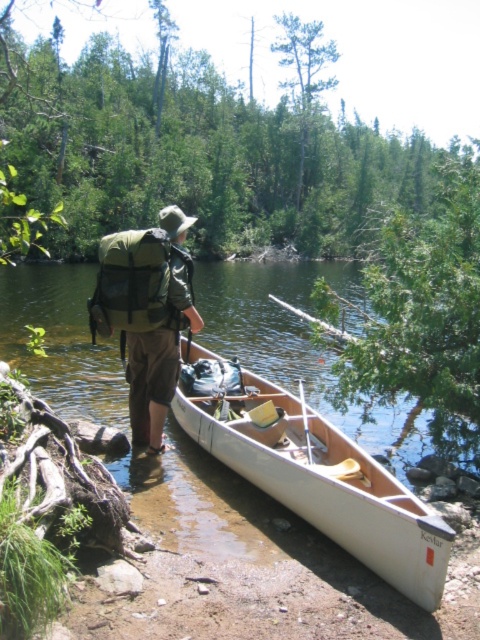
Can you confirm if green fabric backpack at center is positioned below white plastic paddle at center?

Incorrect, green fabric backpack at center is not positioned below white plastic paddle at center.

Is green fabric backpack at center to the left of white plastic paddle at center from the viewer's perspective?

Correct, you'll find green fabric backpack at center to the left of white plastic paddle at center.

Identify the location of green fabric backpack at center. The height and width of the screenshot is (640, 480). (146, 314).

Where is `green fabric backpack at center`? green fabric backpack at center is located at coordinates (146, 314).

The width and height of the screenshot is (480, 640). Describe the element at coordinates (301, 349) in the screenshot. I see `clear water at center` at that location.

Consider the image. Is clear water at center bigger than white plastic paddle at center?

Yes, clear water at center is bigger than white plastic paddle at center.

Between point (286, 364) and point (300, 397), which one is positioned behind?

Positioned behind is point (286, 364).

Where is `clear water at center`? This screenshot has width=480, height=640. clear water at center is located at coordinates (301, 349).

Looking at this image, does clear water at center appear on the left side of green fabric backpack at center?

No, clear water at center is not to the left of green fabric backpack at center.

Can you confirm if clear water at center is thinner than green fabric backpack at center?

No, clear water at center is not thinner than green fabric backpack at center.

Find the location of `clear water at center`. clear water at center is located at coordinates (301, 349).

The image size is (480, 640). What are the coordinates of `clear water at center` in the screenshot? It's located at pyautogui.click(x=301, y=349).